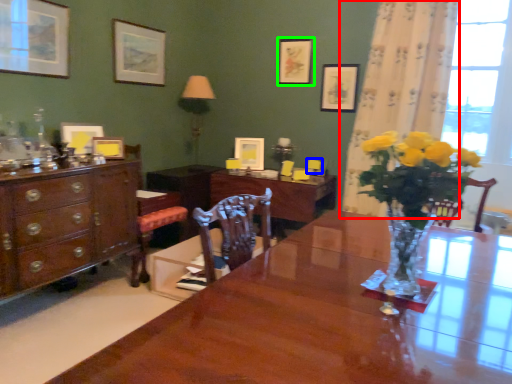
Question: Based on their relative distances, which object is nearer to curtain (highlighted by a red box)? Choose from armchair (highlighted by a blue box) and picture frame (highlighted by a green box).

Choices:
 (A) armchair
 (B) picture frame

Answer: (B)